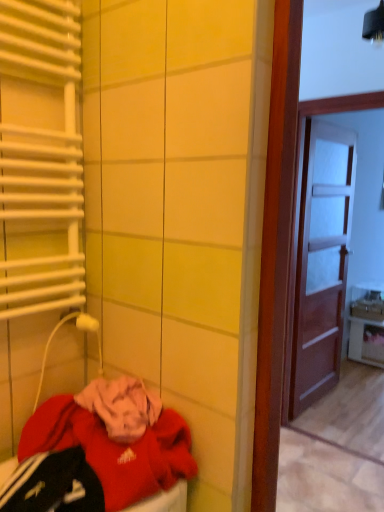
Question: In terms of size, does white glossy cabinet at right appear bigger or smaller than red fleece sweatshirt at lower left?

Choices:
 (A) small
 (B) big

Answer: (B)

Question: Does point (360, 347) appear closer or farther from the camera than point (182, 472)?

Choices:
 (A) farther
 (B) closer

Answer: (A)

Question: Which object is positioned closest to the white glossy cabinet at right?

Choices:
 (A) white metallic radiator at left
 (B) brown wooden door at right
 (C) red fleece sweatshirt at lower left

Answer: (B)

Question: Which of these objects is positioned farthest from the brown wooden door at right?

Choices:
 (A) red fleece sweatshirt at lower left
 (B) white glossy cabinet at right
 (C) white metallic radiator at left

Answer: (C)